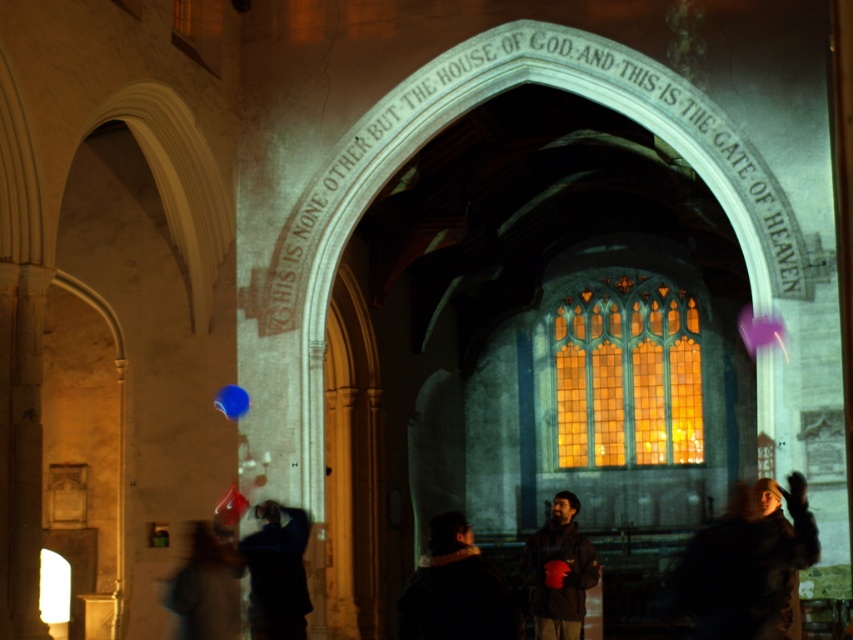
You are standing in the historic church and need to place both the dark brown leather jacket at lower right and the translucent plastic balloon at lower left into a small storage box. Which object should you place first to ensure both fit?

The translucent plastic balloon at lower left should be placed first because the dark brown leather jacket at lower right is larger in size and will require more space. Placing the smaller object first allows the larger one to fit afterward.

You are standing in the historic church and see the point marked at coordinates point (456,589). Based on the scene description, what object is this point located on?

The point (456,589) is located on the dark fabric jacket at lower center.

You are standing in the historic church or cathedral. There is a point located at coordinates point (485, 612). If you want to move closer to this point, which direction should you move?

Since the point (485, 612) is 176.68 feet away from the viewer, you should move forward towards it to get closer.